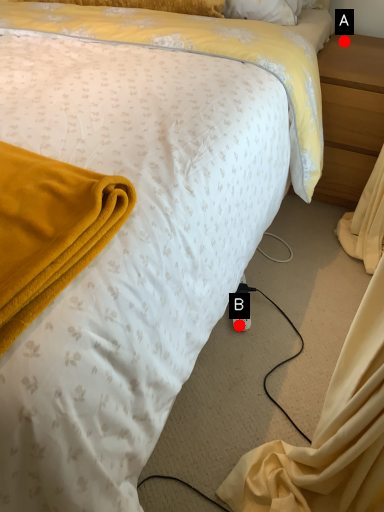
Question: Two points are circled on the image, labeled by A and B beside each circle. Which point appears closest to the camera in this image?

Choices:
 (A) A is closer
 (B) B is closer

Answer: (B)